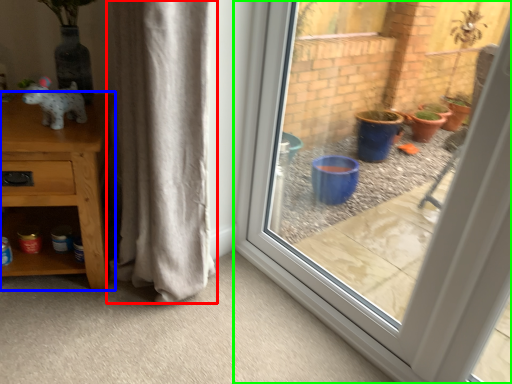
Question: Which is nearer to the curtain (highlighted by a red box)? furniture (highlighted by a blue box) or window (highlighted by a green box).

Choices:
 (A) furniture
 (B) window

Answer: (A)